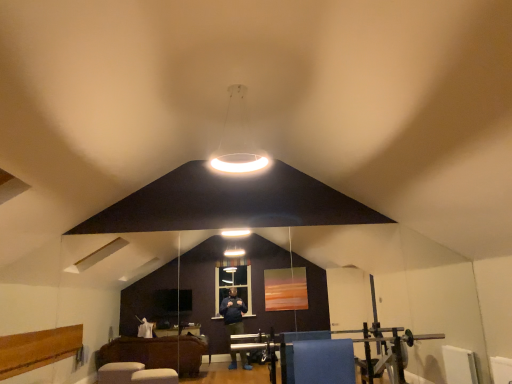
Question: From the image's perspective, relative to blue fabric at lower center, is white glossy ring light at center above or below?

Choices:
 (A) below
 (B) above

Answer: (B)

Question: In the image, is white glossy ring light at center positioned in front of or behind blue fabric at lower center?

Choices:
 (A) front
 (B) behind

Answer: (A)

Question: Considering the positions of white glossy ring light at center and blue fabric at lower center in the image, is white glossy ring light at center taller or shorter than blue fabric at lower center?

Choices:
 (A) short
 (B) tall

Answer: (B)

Question: From the image's perspective, is blue fabric at lower center located above or below white glossy ring light at center?

Choices:
 (A) above
 (B) below

Answer: (B)

Question: Is blue fabric at lower center situated inside white glossy ring light at center or outside?

Choices:
 (A) inside
 (B) outside

Answer: (B)

Question: From a real-world perspective, is blue fabric at lower center physically located above or below white glossy ring light at center?

Choices:
 (A) above
 (B) below

Answer: (B)

Question: Looking at their shapes, would you say blue fabric at lower center is wider or thinner than white glossy ring light at center?

Choices:
 (A) wide
 (B) thin

Answer: (B)